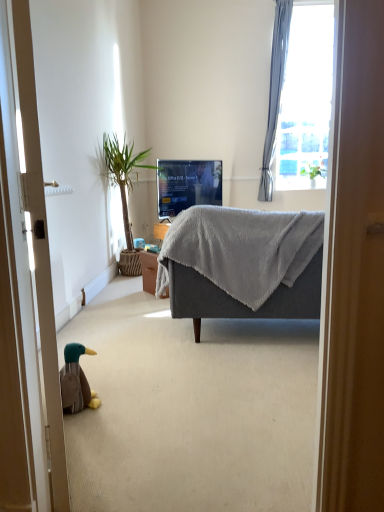
Locate an element on the screen. vacant space in wooden door at left (from a real-world perspective) is located at coordinates (75, 462).